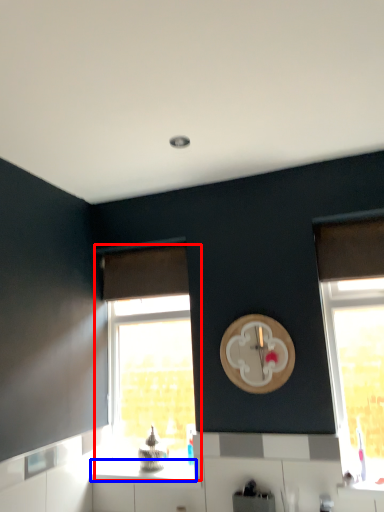
Question: Among these objects, which one is nearest to the camera, window (highlighted by a red box) or counter top (highlighted by a blue box)?

Choices:
 (A) window
 (B) counter top

Answer: (B)